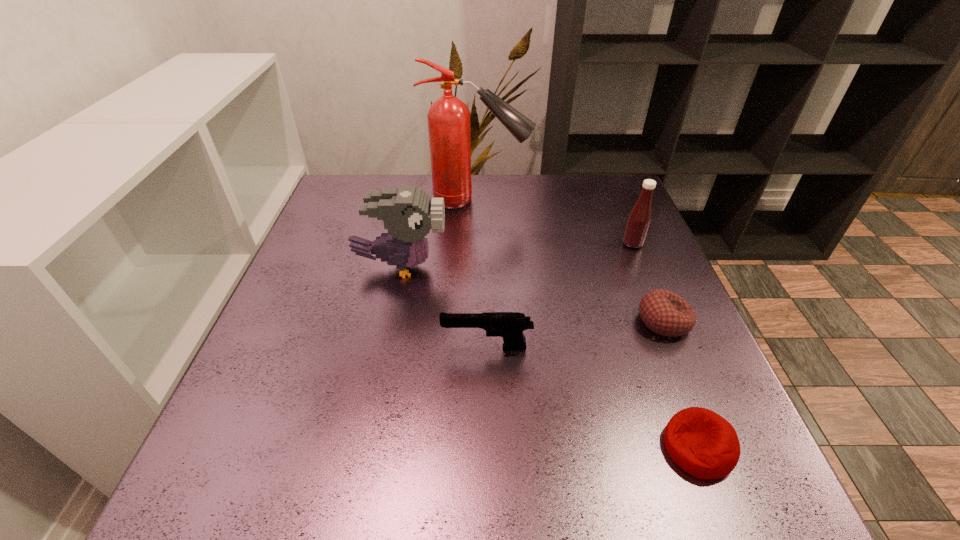
Find the location of a particular element. the farthest object is located at coordinates (448, 118).

The image size is (960, 540). I want to click on the tallest object, so click(x=448, y=118).

What are the coordinates of `bird` in the screenshot? It's located at (408, 213).

Where is `the fifth nearest object`? This screenshot has width=960, height=540. the fifth nearest object is located at coordinates (639, 219).

This screenshot has width=960, height=540. In order to click on the third shortest object in this screenshot , I will do `click(510, 325)`.

Image resolution: width=960 pixels, height=540 pixels. What are the coordinates of `pistol` in the screenshot? It's located at (510, 325).

Locate an element on the screen. The height and width of the screenshot is (540, 960). the fourth farthest object is located at coordinates (665, 313).

Identify the location of the nearer beanbag. (701, 442).

Where is `free spot located at the nozzle end of the fire extinguisher`? The width and height of the screenshot is (960, 540). free spot located at the nozzle end of the fire extinguisher is located at coordinates (605, 200).

Where is `vacant space located at the beak of the third farthest object`? This screenshot has height=540, width=960. vacant space located at the beak of the third farthest object is located at coordinates (585, 267).